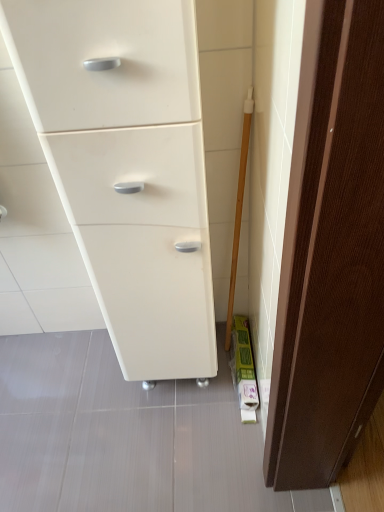
The width and height of the screenshot is (384, 512). In order to click on free spot in front of white plastic chest of drawers at center in this screenshot , I will do `click(176, 445)`.